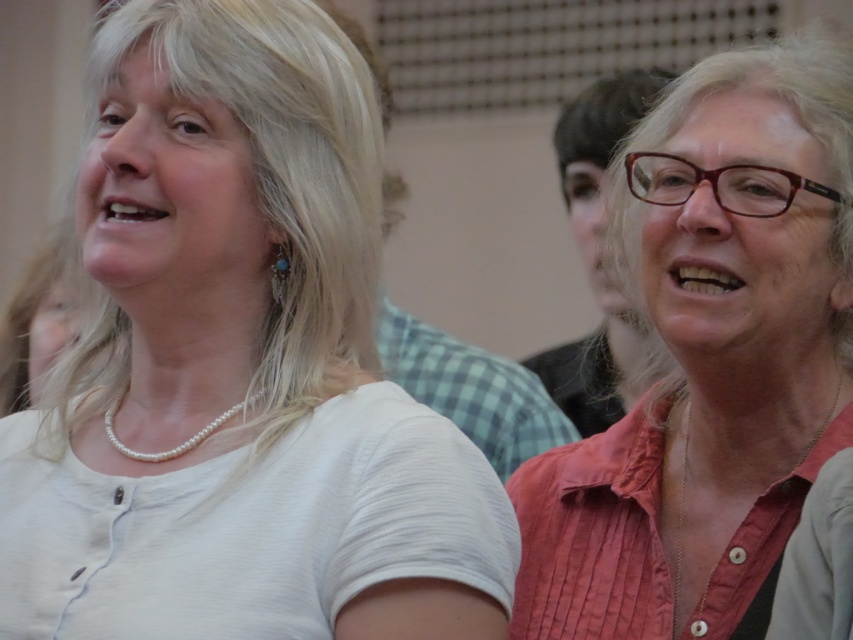
Question: Which point is closer to the camera?

Choices:
 (A) (254, 248)
 (B) (490, 378)
 (C) (599, 273)

Answer: (A)

Question: Can you confirm if checkered fabric shirt at center is thinner than pearl necklace at center?

Choices:
 (A) yes
 (B) no

Answer: (B)

Question: Estimate the real-world distances between objects in this image. Which object is closer to the white matte shirt at center?

Choices:
 (A) matte black shirt at right
 (B) checkered fabric shirt at center
 (C) pink fabric shirt at center

Answer: (C)

Question: Among these objects, which one is farthest from the camera?

Choices:
 (A) pearl necklace at center
 (B) matte black shirt at right
 (C) white matte shirt at center

Answer: (B)

Question: Is matte black shirt at right to the right of pearl necklace at center from the viewer's perspective?

Choices:
 (A) yes
 (B) no

Answer: (A)

Question: Does pink fabric shirt at center have a lesser width compared to matte black shirt at right?

Choices:
 (A) yes
 (B) no

Answer: (B)